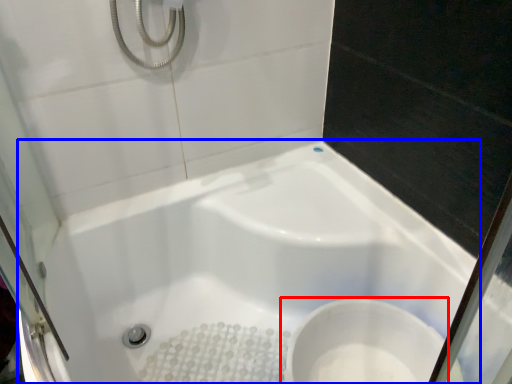
Question: Which object is closer to the camera taking this photo, toilet (highlighted by a red box) or bathtub (highlighted by a blue box)?

Choices:
 (A) toilet
 (B) bathtub

Answer: (B)